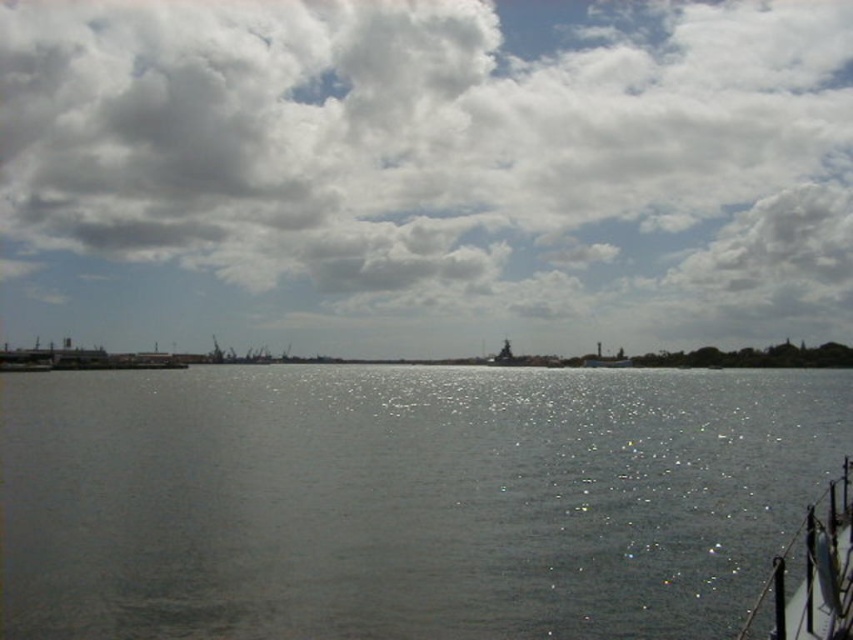
Is white fluffy cloud at upper center to the right of metallic gray boat at lower right from the viewer's perspective?

Incorrect, white fluffy cloud at upper center is not on the right side of metallic gray boat at lower right.

Who is positioned more to the right, white fluffy cloud at upper center or metallic gray boat at lower right?

Positioned to the right is metallic gray boat at lower right.

Which is behind, point (517, 129) or point (840, 609)?

The point (517, 129) is more distant.

Where is `white fluffy cloud at upper center`? This screenshot has width=853, height=640. white fluffy cloud at upper center is located at coordinates (425, 173).

Does gray water at center have a lesser width compared to metallic gray boat at lower right?

Incorrect, gray water at center's width is not less than metallic gray boat at lower right's.

Which is more to the left, gray water at center or metallic gray boat at lower right?

From the viewer's perspective, gray water at center appears more on the left side.

Is point (364, 448) positioned behind point (788, 621)?

Yes, point (364, 448) is behind point (788, 621).

Where is `gray water at center`? gray water at center is located at coordinates (404, 499).

Which is behind, point (729, 10) or point (257, 490)?

Positioned behind is point (729, 10).

Does white fluffy cloud at upper center have a greater width compared to gray water at center?

Correct, the width of white fluffy cloud at upper center exceeds that of gray water at center.

Who is more forward, (x=337, y=339) or (x=474, y=557)?

Point (x=474, y=557) is more forward.

Locate an element on the screen. The width and height of the screenshot is (853, 640). white fluffy cloud at upper center is located at coordinates (425, 173).